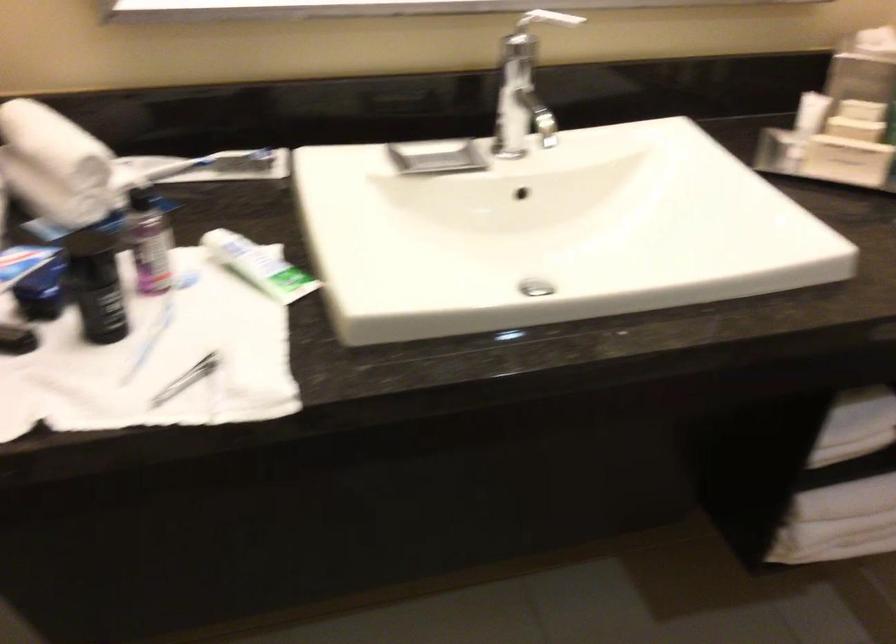
Where would you lift the toothpaste tube? Please return your answer as a coordinate pair (x, y).

(259, 265)